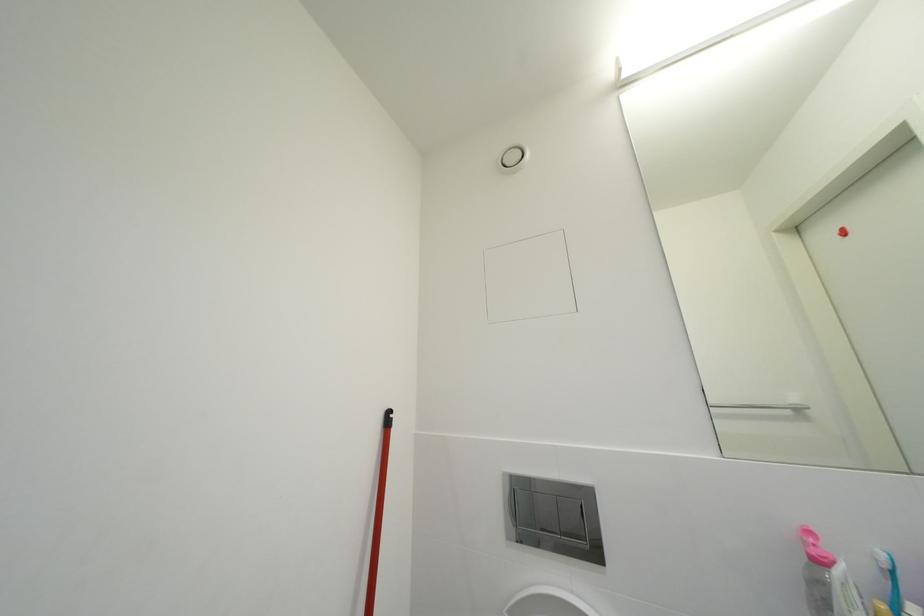
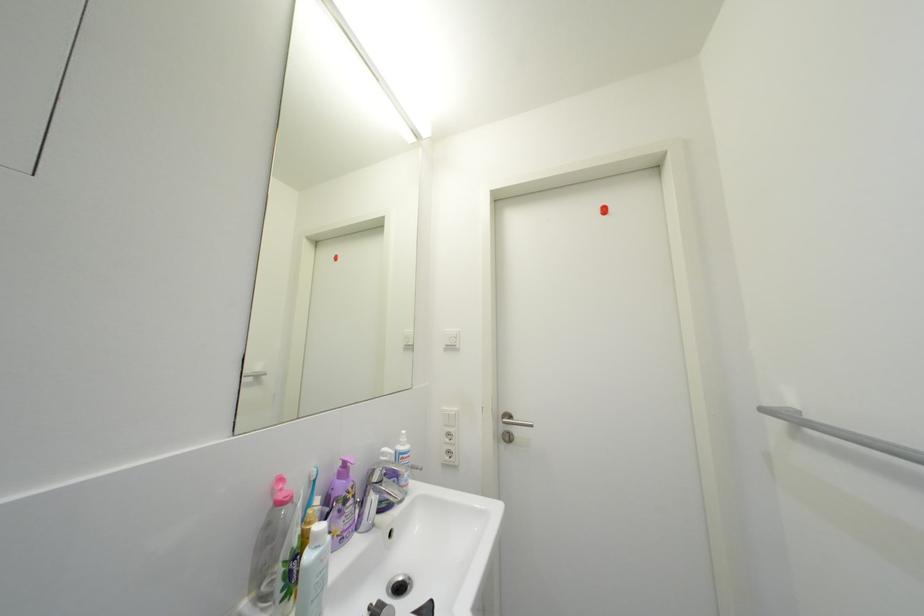
Question: The first image is from the beginning of the video and the second image is from the end. How did the camera likely rotate when shooting the video?

Choices:
 (A) Left
 (B) Right
 (C) Up
 (D) Down

Answer: (B)